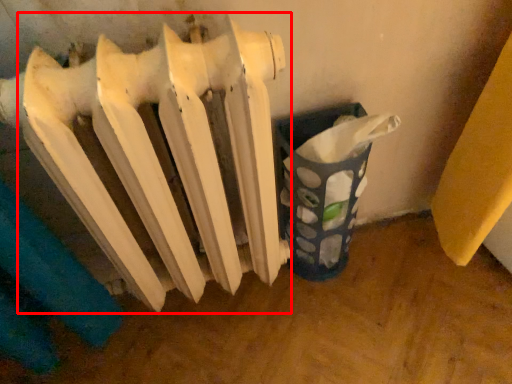
Question: From the image's perspective, what is the correct spatial positioning of radiator (annotated by the red box) in reference to waste container?

Choices:
 (A) below
 (B) above

Answer: (A)